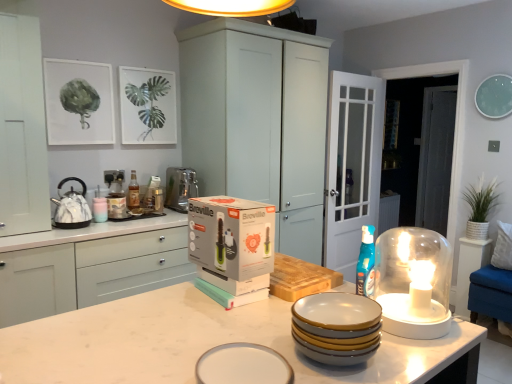
What do you see at coordinates (482, 200) in the screenshot?
I see `green leafy plant in white pot at right, positioned as the 2th plant in top-to-bottom order` at bounding box center [482, 200].

The image size is (512, 384). What do you see at coordinates (436, 158) in the screenshot?
I see `transparent glass door at right, positioned as the second glass door in front-to-back order` at bounding box center [436, 158].

What do you see at coordinates (22, 129) in the screenshot? I see `white matte cabinet at left, the 1th cabinetry from the left` at bounding box center [22, 129].

What are the coordinates of `matte ceramic candle holder at left, the 2th candle holder from the front` in the screenshot? It's located at (116, 206).

Where is `clear glass door at center, which appears as the first glass door when viewed from the front`? Image resolution: width=512 pixels, height=384 pixels. clear glass door at center, which appears as the first glass door when viewed from the front is located at coordinates (350, 168).

This screenshot has width=512, height=384. What do you see at coordinates (243, 365) in the screenshot? I see `white glossy plate at center` at bounding box center [243, 365].

This screenshot has height=384, width=512. What do you see at coordinates (259, 121) in the screenshot?
I see `white matte cabinet at center, marked as the 1th cabinetry in a right-to-left arrangement` at bounding box center [259, 121].

Where is `green leafy plant in white pot at right, positioned as the 2th plant in top-to-bottom order`? green leafy plant in white pot at right, positioned as the 2th plant in top-to-bottom order is located at coordinates pos(482,200).

Starting from the green leafy plant in white pot at right, placed as the second plant when sorted from left to right, which candle holder is the 2nd one in front? Please provide its 2D coordinates.

[(414, 282)]

Which object is positioned more to the right, translucent glass candle holder at right, the second candle holder positioned from the left, or green leafy plant in white pot at right, arranged as the first plant when ordered from the bottom?

green leafy plant in white pot at right, arranged as the first plant when ordered from the bottom, is more to the right.

Which is closer to the camera, (399,323) or (492,209)?

Clearly, point (399,323) is closer to the camera than point (492,209).

Measure the distance between teal plastic spray bottle at center-right and white matte cabinet at left, the second cabinetry when ordered from left to right.

teal plastic spray bottle at center-right is 1.47 meters away from white matte cabinet at left, the second cabinetry when ordered from left to right.

Between teal plastic spray bottle at center-right and white matte cabinet at left, the second cabinetry when ordered from left to right, which one has larger width?

Wider between the two is white matte cabinet at left, the second cabinetry when ordered from left to right.

Considering the relative sizes of teal plastic spray bottle at center-right and white matte cabinet at left, which is the 2th cabinetry from right to left, in the image provided, is teal plastic spray bottle at center-right shorter than white matte cabinet at left, which is the 2th cabinetry from right to left,?

Yes, teal plastic spray bottle at center-right is shorter than white matte cabinet at left, which is the 2th cabinetry from right to left.

Could you tell me if teal plastic spray bottle at center-right is facing white matte cabinet at left, the second cabinetry when ordered from left to right?

No, teal plastic spray bottle at center-right is not facing towards white matte cabinet at left, the second cabinetry when ordered from left to right.

From the image's perspective, is white glossy table at right under marble/textured kettle at left?

Yes, from the image's perspective, white glossy table at right is below marble/textured kettle at left.

Can you confirm if white glossy table at right is wider than marble/textured kettle at left?

Correct, the width of white glossy table at right exceeds that of marble/textured kettle at left.

Is white glossy table at right far from marble/textured kettle at left?

Absolutely, white glossy table at right is distant from marble/textured kettle at left.

Considering the sizes of objects white glossy table at right and marble/textured kettle at left in the image provided, who is smaller, white glossy table at right or marble/textured kettle at left?

marble/textured kettle at left.

Is satin silver appliance at left aimed at marble/textured kettle at left?

No, satin silver appliance at left is not oriented towards marble/textured kettle at left.

Can you confirm if satin silver appliance at left is shorter than marble/textured kettle at left?

No, satin silver appliance at left is not shorter than marble/textured kettle at left.

Would you say marble/textured kettle at left is part of satin silver appliance at left's contents?

No.

From a real-world perspective, is satin silver appliance at left positioned under marble/textured kettle at left based on gravity?

Yes, from a real-world perspective, satin silver appliance at left is below marble/textured kettle at left.

You are a GUI agent. You are given a task and a screenshot of the screen. Output one action in this format:
    pyautogui.click(x=<x>, y=<y>)
    Task: Click on the table to the right of teal plastic spray bottle at center-right
    
    Given the screenshot: What is the action you would take?
    pyautogui.click(x=469, y=270)

From the image's perspective, is teal plastic spray bottle at center-right beneath white glossy table at right?

No.

Would you say teal plastic spray bottle at center-right is inside or outside white glossy table at right?

teal plastic spray bottle at center-right is located beyond the bounds of white glossy table at right.

Is there a large distance between teal plastic spray bottle at center-right and white glossy table at right?

Yes, teal plastic spray bottle at center-right and white glossy table at right are quite far apart.

How much distance is there between satin silver appliance at left and green leafy plant at upper left, marked as the 1th plant in a left-to-right arrangement?

47.54 centimeters.

From a real-world perspective, which is physically below, satin silver appliance at left or green leafy plant at upper left, placed as the 2th plant when sorted from right to left?

satin silver appliance at left, from a real-world perspective.

Is satin silver appliance at left positioned far away from green leafy plant at upper left, marked as the 1th plant in a left-to-right arrangement?

satin silver appliance at left is actually quite close to green leafy plant at upper left, marked as the 1th plant in a left-to-right arrangement.

Which object is further away from the camera, clear glass door at center, which appears as the first glass door when viewed from the front, or white glossy plate at center?

clear glass door at center, which appears as the first glass door when viewed from the front, is further from the camera.

Is clear glass door at center, the 2th glass door positioned from the right, looking in the opposite direction of white glossy plate at center?

No, clear glass door at center, the 2th glass door positioned from the right,'s orientation is not away from white glossy plate at center.

Is clear glass door at center, arranged as the first glass door when viewed from the left, at the left side of white glossy plate at center?

In fact, clear glass door at center, arranged as the first glass door when viewed from the left, is to the right of white glossy plate at center.

From the image's perspective, is clear glass door at center, arranged as the first glass door when viewed from the left, positioned above or below white glossy plate at center?

clear glass door at center, arranged as the first glass door when viewed from the left, is above white glossy plate at center.

From a real-world perspective, which candle holder is the 2nd one above the green leafy plant in white pot at right, positioned as the 2th plant in top-to-bottom order? Please provide its 2D coordinates.

[(414, 282)]

In the image, there is a white matte cabinet at left, which is the 2th cabinetry from right to left. At what (x,y) coordinates should I click in order to perform the action: click on teal above it (from the image's perspective). Please return your answer as a coordinate pair (x, y). This screenshot has width=512, height=384. Looking at the image, I should click on (366, 263).

From the image, which object appears to be farther from white matte cabinet at left, the second cabinetry when ordered from left to right, marble/textured kettle at left or white glossy plate at center?

white glossy plate at center is further to white matte cabinet at left, the second cabinetry when ordered from left to right.

Estimate the real-world distances between objects in this image. Which object is further from marble/textured kettle at left, white glossy plate at center or green leafy plant in white pot at right, arranged as the first plant when ordered from the bottom?

Among the two, green leafy plant in white pot at right, arranged as the first plant when ordered from the bottom, is located further to marble/textured kettle at left.

Based on their spatial positions, is white matte cabinet at center, acting as the 3th cabinetry starting from the left, or teal plastic spray bottle at center-right closer to white glossy plate at center?

teal plastic spray bottle at center-right is closer to white glossy plate at center.

Considering their positions, is green leafy plant at upper left, which is the 1th plant from top to bottom, positioned closer to matte ceramic candle holder at left, which appears as the second candle holder when viewed from the right, than teal plastic spray bottle at center-right?

Based on the image, green leafy plant at upper left, which is the 1th plant from top to bottom, appears to be nearer to matte ceramic candle holder at left, which appears as the second candle holder when viewed from the right.

From the image, which object appears to be farther from marble/textured kettle at left, white matte cabinet at center, marked as the 1th cabinetry in a right-to-left arrangement, or matte ceramic candle holder at left, which is counted as the first candle holder, starting from the left?

white matte cabinet at center, marked as the 1th cabinetry in a right-to-left arrangement, is further to marble/textured kettle at left.

Considering their positions, is white glossy table at right positioned further to white matte cabinet at left, the 1th cabinetry from the left, than white glossy plate at center?

white glossy table at right is further to white matte cabinet at left, the 1th cabinetry from the left.

Looking at the image, which one is located further to matte glass bottle at upper left, clear glass door at center, arranged as the first glass door when viewed from the left, or white matte cabinet at left, the 1th cabinetry from the left?

Among the two, clear glass door at center, arranged as the first glass door when viewed from the left, is located further to matte glass bottle at upper left.

In the scene shown: When comparing their distances from white matte cabinet at left, the 1th cabinetry from the left, does white matte cabinet at center, acting as the 3th cabinetry starting from the left, or white fabric pillow at right seem closer?

Among the two, white matte cabinet at center, acting as the 3th cabinetry starting from the left, is located nearer to white matte cabinet at left, the 1th cabinetry from the left.

Identify the location of appliance between white matte cabinet at left, which is the 2th cabinetry from right to left, and transparent glass door at right, marked as the 1th glass door in a right-to-left arrangement, from left to right. The height and width of the screenshot is (384, 512). (154, 195).

At what (x,y) coordinates should I click in order to perform the action: click on cabinetry between matte glass bottle at upper left and clear glass door at center, arranged as the second glass door when viewed from the back. Please return your answer as a coordinate pair (x, y). The height and width of the screenshot is (384, 512). Looking at the image, I should click on (259, 121).

Where is `appliance between matte ceramic candle holder at left, which is counted as the first candle holder, starting from the left, and white matte cabinet at center, marked as the 1th cabinetry in a right-to-left arrangement, from left to right`? Image resolution: width=512 pixels, height=384 pixels. appliance between matte ceramic candle holder at left, which is counted as the first candle holder, starting from the left, and white matte cabinet at center, marked as the 1th cabinetry in a right-to-left arrangement, from left to right is located at coordinates (154, 195).

The width and height of the screenshot is (512, 384). I want to click on tableware located between satin silver appliance at left and white fabric pillow at right in the left-right direction, so click(243, 365).